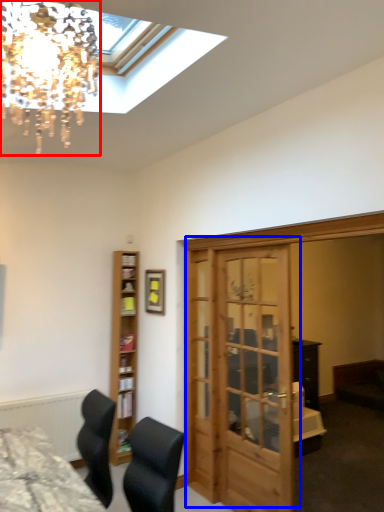
Question: Which point is closer to the camera, lamp (highlighted by a red box) or door (highlighted by a blue box)?

Choices:
 (A) lamp
 (B) door

Answer: (A)